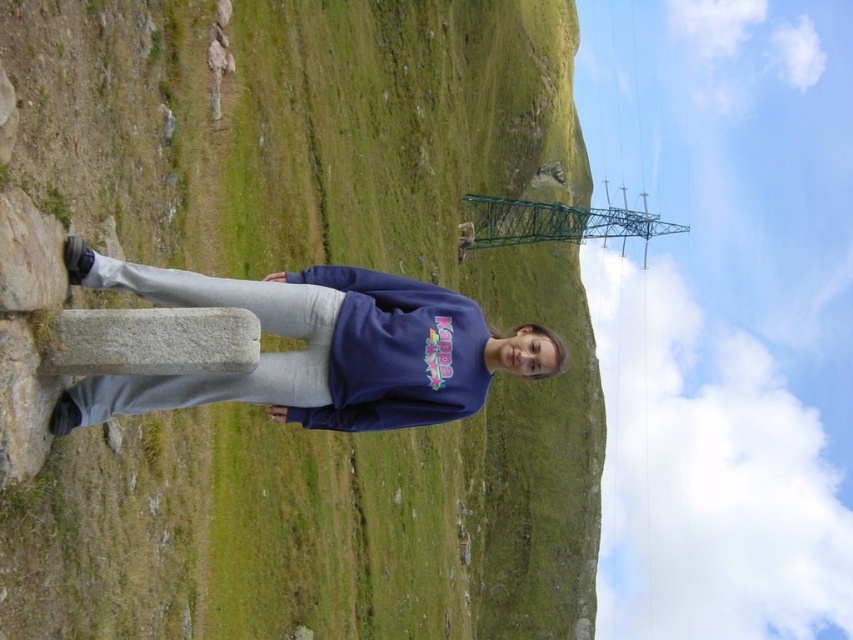
Question: Which of the following is the farthest from the observer?

Choices:
 (A) matte blue sweatshirt at center
 (B) green grassy hillside at center

Answer: (A)

Question: Which object is closer to the camera taking this photo?

Choices:
 (A) green grassy hillside at center
 (B) matte blue sweatshirt at center

Answer: (A)

Question: From the image, what is the correct spatial relationship of green grassy hillside at center in relation to matte blue sweatshirt at center?

Choices:
 (A) above
 (B) below

Answer: (A)

Question: Can you confirm if green grassy hillside at center is thinner than matte blue sweatshirt at center?

Choices:
 (A) no
 (B) yes

Answer: (A)

Question: Which object appears closest to the camera in this image?

Choices:
 (A) green grassy hillside at center
 (B) matte blue sweatshirt at center

Answer: (A)

Question: Is green grassy hillside at center bigger than matte blue sweatshirt at center?

Choices:
 (A) yes
 (B) no

Answer: (A)